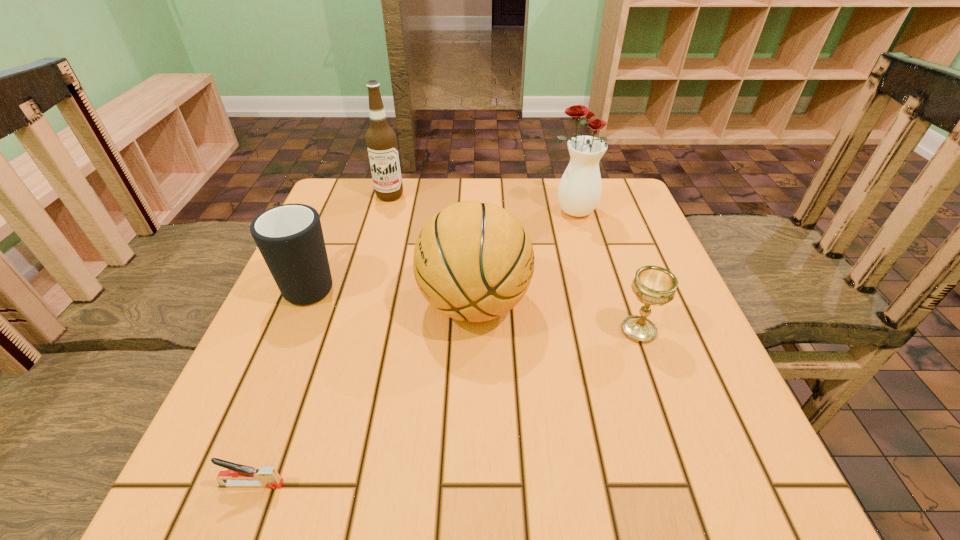
Identify the location of vacant space at the far right corner of the desktop. Image resolution: width=960 pixels, height=540 pixels. (627, 183).

Locate an element on the screen. This screenshot has width=960, height=540. free area in between the vase and the stapler is located at coordinates (412, 348).

Identify the location of free space between the fourth shortest object and the chalice. The image size is (960, 540). (557, 317).

Find the location of a particular element. The height and width of the screenshot is (540, 960). vacant space that's between the stapler and the fourth object from left to right is located at coordinates (363, 394).

Where is `free point between the vase and the shortest object`? The height and width of the screenshot is (540, 960). free point between the vase and the shortest object is located at coordinates (412, 348).

Locate an element on the screen. The height and width of the screenshot is (540, 960). unoccupied area between the chalice and the vase is located at coordinates (605, 271).

Find the location of a particular element. blank region between the stapler and the alcohol is located at coordinates (321, 340).

The image size is (960, 540). In order to click on object that can be found as the third closest to the third shortest object in this screenshot , I will do `click(238, 475)`.

Locate an element on the screen. object that is the third closest to the alcohol is located at coordinates coord(579,192).

The image size is (960, 540). I want to click on free space that satisfies the following two spatial constraints: 1. on the front side of the vase; 2. on the surface of the third tallest object near the brand logo, so click(597, 304).